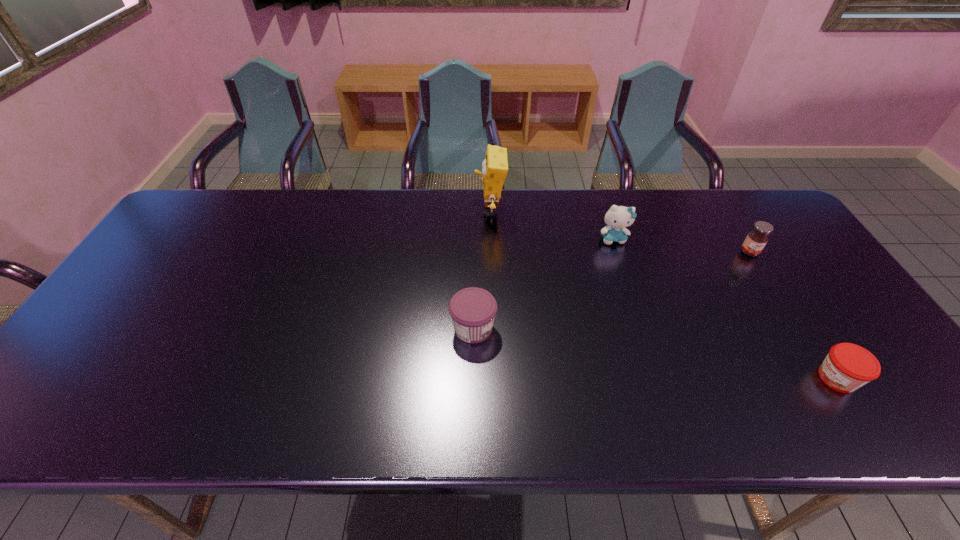
You are a GUI agent. You are given a task and a screenshot of the screen. Output one action in this format:
    pyautogui.click(x=<x>, y=<y>)
    Task: Click on the tallest object
    
    Given the screenshot: What is the action you would take?
    pyautogui.click(x=495, y=165)

At what (x,y) coordinates should I click in order to perform the action: click on the third object from left to right. Please return your answer as a coordinate pair (x, y). Looking at the image, I should click on (617, 218).

Where is `kitten`? The image size is (960, 540). kitten is located at coordinates (617, 218).

This screenshot has width=960, height=540. I want to click on the farthest jam, so click(757, 238).

Image resolution: width=960 pixels, height=540 pixels. In order to click on the second farthest jam in this screenshot , I will do tap(473, 310).

The image size is (960, 540). What are the coordinates of `the leftmost jam` in the screenshot? It's located at (473, 310).

Where is `the nearest jam`? The image size is (960, 540). the nearest jam is located at coordinates (847, 367).

The height and width of the screenshot is (540, 960). What are the coordinates of `the shortest object` in the screenshot? It's located at (847, 367).

Locate an element on the screen. free location located on the face of the tallest object is located at coordinates (368, 210).

This screenshot has height=540, width=960. Find the location of `free space located on the face of the tallest object`. free space located on the face of the tallest object is located at coordinates (352, 210).